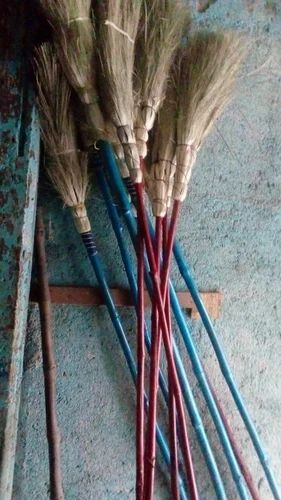
Image resolution: width=281 pixels, height=500 pixels. What are the coordinates of `handle` in the screenshot? It's located at (252, 430).